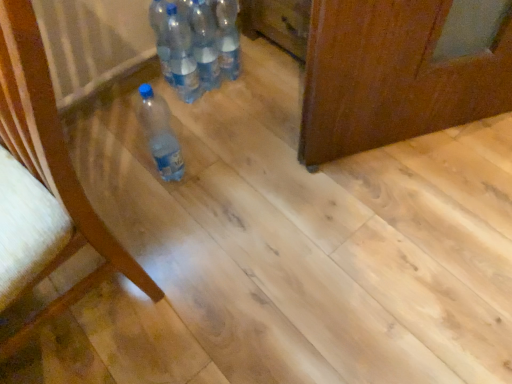
Identify the location of free point to the right of matte wood chair at left. Image resolution: width=512 pixels, height=384 pixels. (222, 276).